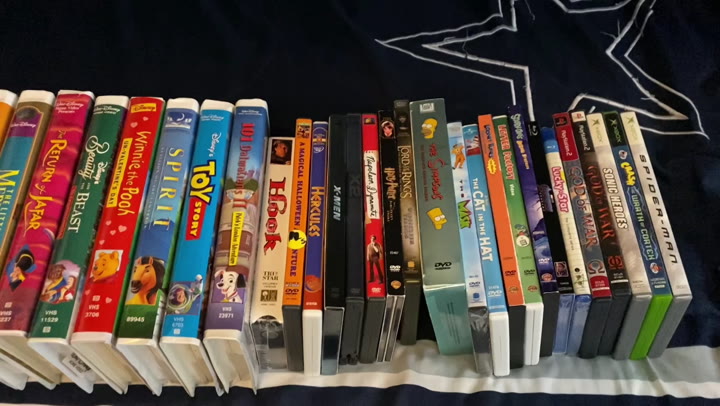
Where is `vhs tapes`? The height and width of the screenshot is (406, 720). vhs tapes is located at coordinates (6, 103), (27, 126), (54, 142), (96, 156), (132, 164), (163, 171), (202, 176), (235, 192), (271, 214).